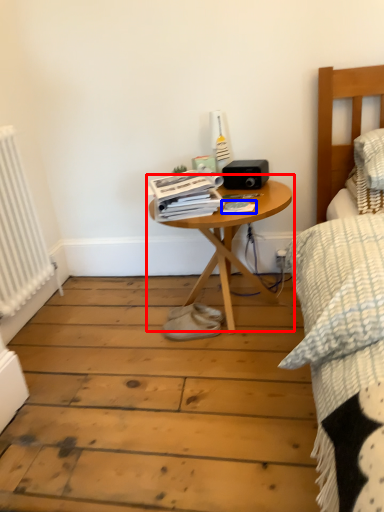
Question: Among these objects, which one is nearest to the camera, table (highlighted by a red box) or magazine (highlighted by a blue box)?

Choices:
 (A) table
 (B) magazine

Answer: (A)